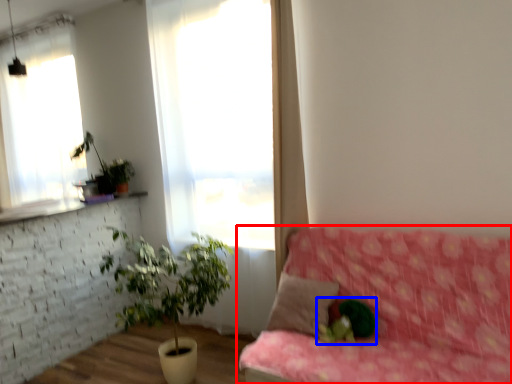
Question: Which point is closer to the camera, studio couch (highlighted by a red box) or plant (highlighted by a blue box)?

Choices:
 (A) studio couch
 (B) plant

Answer: (A)